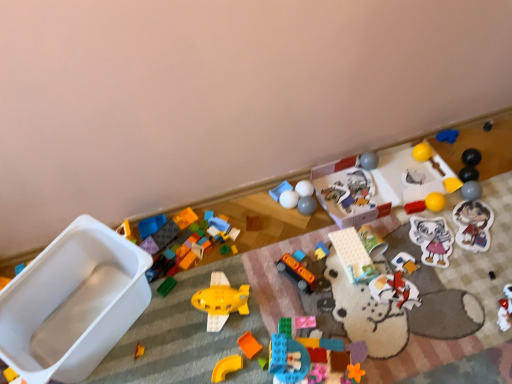
You are a GUI agent. You are given a task and a screenshot of the screen. Output one action in this format:
    pyautogui.click(x=<x>, y=<y>)
    Task: Click on the unoccupied space behind orange matte bus at center, the sixteenth toy in the right-to-left sequence
    
    Given the screenshot: What is the action you would take?
    [293, 247]